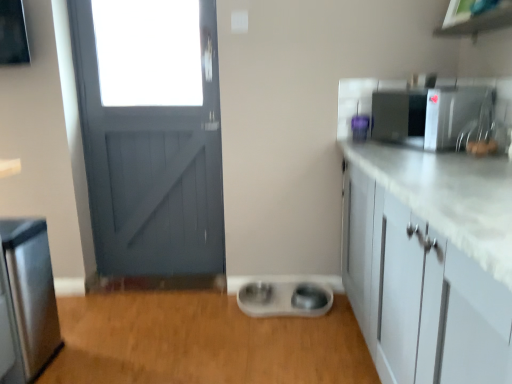
In order to face satin silver microwave at upper right, marked as the third appliance in a left-to-right arrangement, should I rotate leftwards or rightwards?

Rotate your view right by about 21.887°.

Describe the element at coordinates (31, 292) in the screenshot. I see `stainless steel refrigerator at left, which is counted as the first appliance, starting from the left` at that location.

You are a GUI agent. You are given a task and a screenshot of the screen. Output one action in this format:
    pyautogui.click(x=<x>, y=<y>)
    Task: Click on the white plastic pet bowls at center
    This screenshot has height=384, width=512.
    Given the screenshot: What is the action you would take?
    pyautogui.click(x=203, y=342)

This screenshot has width=512, height=384. What are the coordinates of `satin silver microwave at upper right, acting as the 1th appliance starting from the right` in the screenshot? It's located at (430, 115).

Can you confirm if white plastic pet bowls at center is bigger than stainless steel refrigerator at left, which is counted as the first appliance, starting from the left?

Yes.

Considering the relative sizes of white plastic pet bowls at center and stainless steel refrigerator at left, which is counted as the 3th appliance, starting from the right, in the image provided, is white plastic pet bowls at center taller than stainless steel refrigerator at left, which is counted as the 3th appliance, starting from the right,?

No, white plastic pet bowls at center is not taller than stainless steel refrigerator at left, which is counted as the 3th appliance, starting from the right.

From a real-world perspective, relative to stainless steel refrigerator at left, which is counted as the 3th appliance, starting from the right, is white plastic pet bowls at center vertically above or below?

white plastic pet bowls at center is below stainless steel refrigerator at left, which is counted as the 3th appliance, starting from the right.

Would you say white plastic pet bowls at center is inside or outside stainless steel refrigerator at left, which is counted as the 1th appliance, starting from the bottom?

white plastic pet bowls at center is located beyond the bounds of stainless steel refrigerator at left, which is counted as the 1th appliance, starting from the bottom.

Considering the sizes of objects white plastic pet bowls at center and purple plastic container at upper right, the 2th appliance positioned from the right, in the image provided, who is taller, white plastic pet bowls at center or purple plastic container at upper right, the 2th appliance positioned from the right,?

Standing taller between the two is purple plastic container at upper right, the 2th appliance positioned from the right.

Considering the points (198, 369) and (369, 122), which point is in front, point (198, 369) or point (369, 122)?

The point (198, 369) is closer.

Is white plastic pet bowls at center positioned behind purple plastic container at upper right, the 2th appliance positioned from the top?

No, it is not.

Looking at this image, is white plastic pet bowls at center surrounding purple plastic container at upper right, which is the 2th appliance from left to right?

No, purple plastic container at upper right, which is the 2th appliance from left to right, is not inside white plastic pet bowls at center.

From the image's perspective, is stainless steel refrigerator at left, which is counted as the 3th appliance, starting from the right, positioned above or below satin nickel faucet at upper right?

From the image's perspective, stainless steel refrigerator at left, which is counted as the 3th appliance, starting from the right, appears below satin nickel faucet at upper right.

How many degrees apart are the facing directions of stainless steel refrigerator at left, placed as the 3th appliance when sorted from top to bottom, and satin nickel faucet at upper right?

There is a 90.3-degree angle between the facing directions of stainless steel refrigerator at left, placed as the 3th appliance when sorted from top to bottom, and satin nickel faucet at upper right.

Where is `sink on the right of stainless steel refrigerator at left, placed as the 3th appliance when sorted from top to bottom`? sink on the right of stainless steel refrigerator at left, placed as the 3th appliance when sorted from top to bottom is located at coordinates (484, 131).

Considering the sizes of objects stainless steel refrigerator at left, placed as the 3th appliance when sorted from top to bottom, and satin nickel faucet at upper right in the image provided, who is shorter, stainless steel refrigerator at left, placed as the 3th appliance when sorted from top to bottom, or satin nickel faucet at upper right?

With less height is satin nickel faucet at upper right.

In terms of height, does white plastic pet bowls at center look taller or shorter compared to satin nickel faucet at upper right?

Clearly, white plastic pet bowls at center is shorter compared to satin nickel faucet at upper right.

From a real-world perspective, is white plastic pet bowls at center positioned under satin nickel faucet at upper right based on gravity?

Yes, from a real-world perspective, white plastic pet bowls at center is beneath satin nickel faucet at upper right.

Measure the distance between white plastic pet bowls at center and satin nickel faucet at upper right.

white plastic pet bowls at center and satin nickel faucet at upper right are 1.36 meters apart.

Identify the location of plain below the satin nickel faucet at upper right (from a real-world perspective). (203, 342).

From a real-world perspective, is satin nickel faucet at upper right physically below stainless steel refrigerator at left, which is counted as the first appliance, starting from the left?

No, from a real-world perspective, satin nickel faucet at upper right is not beneath stainless steel refrigerator at left, which is counted as the first appliance, starting from the left.

Is satin nickel faucet at upper right aimed at stainless steel refrigerator at left, placed as the 3th appliance when sorted from top to bottom?

No.

Which object is positioned more to the right, satin nickel faucet at upper right or stainless steel refrigerator at left, which is counted as the 3th appliance, starting from the right?

satin nickel faucet at upper right.

Would you say stainless steel refrigerator at left, which is counted as the 3th appliance, starting from the right, is part of satin nickel faucet at upper right's contents?

No, stainless steel refrigerator at left, which is counted as the 3th appliance, starting from the right, is not surrounded by satin nickel faucet at upper right.

How different are the orientations of satin nickel faucet at upper right and white plastic pet bowls at center in degrees?

180 degrees.

Which of these two, satin nickel faucet at upper right or white plastic pet bowls at center, stands shorter?

Standing shorter between the two is white plastic pet bowls at center.

Is point (490, 90) behind point (184, 316)?

No, (490, 90) is closer to viewer.

From the picture: From the image's perspective, relative to satin silver microwave at upper right, the 3th appliance positioned from the bottom, is stainless steel refrigerator at left, placed as the 3th appliance when sorted from top to bottom, above or below?

From the image's perspective, stainless steel refrigerator at left, placed as the 3th appliance when sorted from top to bottom, appears below satin silver microwave at upper right, the 3th appliance positioned from the bottom.

Is stainless steel refrigerator at left, which is counted as the 3th appliance, starting from the right, oriented away from satin silver microwave at upper right, marked as the third appliance in a left-to-right arrangement?

No, stainless steel refrigerator at left, which is counted as the 3th appliance, starting from the right, is not facing the opposite direction of satin silver microwave at upper right, marked as the third appliance in a left-to-right arrangement.

Choose the correct answer: Is stainless steel refrigerator at left, which is counted as the 1th appliance, starting from the bottom, inside satin silver microwave at upper right, which appears as the first appliance when viewed from the top, or outside it?

stainless steel refrigerator at left, which is counted as the 1th appliance, starting from the bottom, is outside satin silver microwave at upper right, which appears as the first appliance when viewed from the top.

Is stainless steel refrigerator at left, which is counted as the first appliance, starting from the left, behind satin silver microwave at upper right, the 3th appliance positioned from the bottom?

No, the depth of stainless steel refrigerator at left, which is counted as the first appliance, starting from the left, is less than that of satin silver microwave at upper right, the 3th appliance positioned from the bottom.

I want to click on the 2nd appliance in front of the white plastic pet bowls at center, so click(31, 292).

I want to click on plain below the purple plastic container at upper right, the 2th appliance positioned from the top (from the image's perspective), so click(203, 342).

Looking at this image, looking at the image, which one is located closer to white plastic pet bowls at center, satin nickel faucet at upper right or purple plastic container at upper right, the second appliance positioned from the bottom?

purple plastic container at upper right, the second appliance positioned from the bottom, lies closer to white plastic pet bowls at center than the other object.

Looking at the image, which one is located further to purple plastic container at upper right, the 2th appliance positioned from the top, satin nickel faucet at upper right or stainless steel refrigerator at left, which is counted as the first appliance, starting from the left?

Among the two, stainless steel refrigerator at left, which is counted as the first appliance, starting from the left, is located further to purple plastic container at upper right, the 2th appliance positioned from the top.

Which object lies further to the anchor point white plastic pet bowls at center, stainless steel refrigerator at left, which is counted as the 3th appliance, starting from the right, or purple plastic container at upper right, the 2th appliance positioned from the right?

purple plastic container at upper right, the 2th appliance positioned from the right, is positioned further to the anchor white plastic pet bowls at center.

Which object lies further to the anchor point stainless steel refrigerator at left, which is counted as the 3th appliance, starting from the right, white plastic pet bowls at center or purple plastic container at upper right, which is the 2th appliance from left to right?

purple plastic container at upper right, which is the 2th appliance from left to right.

Which object lies further to the anchor point purple plastic container at upper right, the second appliance positioned from the bottom, stainless steel refrigerator at left, which is counted as the 1th appliance, starting from the bottom, or satin silver microwave at upper right, which appears as the first appliance when viewed from the top?

Based on the image, stainless steel refrigerator at left, which is counted as the 1th appliance, starting from the bottom, appears to be further to purple plastic container at upper right, the second appliance positioned from the bottom.

Considering their positions, is satin nickel faucet at upper right positioned closer to stainless steel refrigerator at left, which is counted as the first appliance, starting from the left, than satin silver microwave at upper right, acting as the 1th appliance starting from the right?

satin silver microwave at upper right, acting as the 1th appliance starting from the right, lies closer to stainless steel refrigerator at left, which is counted as the first appliance, starting from the left, than the other object.

Looking at the image, which one is located closer to satin nickel faucet at upper right, stainless steel refrigerator at left, which is counted as the 3th appliance, starting from the right, or satin silver microwave at upper right, which appears as the first appliance when viewed from the top?

satin silver microwave at upper right, which appears as the first appliance when viewed from the top, lies closer to satin nickel faucet at upper right than the other object.

Based on their spatial positions, is satin nickel faucet at upper right or purple plastic container at upper right, the 2th appliance positioned from the top, further from stainless steel refrigerator at left, which is counted as the 1th appliance, starting from the bottom?

The object further to stainless steel refrigerator at left, which is counted as the 1th appliance, starting from the bottom, is satin nickel faucet at upper right.

Locate an element on the screen. appliance between white plastic pet bowls at center and satin silver microwave at upper right, acting as the 1th appliance starting from the right, in the horizontal direction is located at coordinates (360, 125).

Find the location of a particular element. The image size is (512, 384). appliance between satin nickel faucet at upper right and purple plastic container at upper right, which is the 2th appliance from left to right, along the z-axis is located at coordinates (430, 115).

Identify the location of appliance located between stainless steel refrigerator at left, placed as the 3th appliance when sorted from top to bottom, and satin silver microwave at upper right, acting as the 1th appliance starting from the right, in the left-right direction. Image resolution: width=512 pixels, height=384 pixels. (360, 125).

Where is `plain between stainless steel refrigerator at left, placed as the 3th appliance when sorted from top to bottom, and satin silver microwave at upper right, acting as the 1th appliance starting from the right`? This screenshot has width=512, height=384. plain between stainless steel refrigerator at left, placed as the 3th appliance when sorted from top to bottom, and satin silver microwave at upper right, acting as the 1th appliance starting from the right is located at coordinates (203, 342).